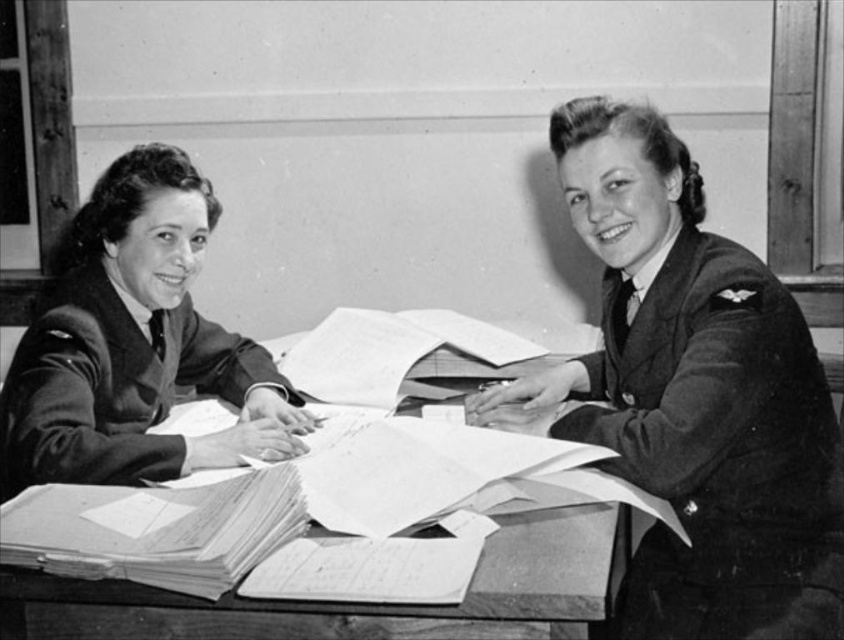
Between uniformed woman at center and smooth fabric uniform at left, which one appears on the left side from the viewer's perspective?

smooth fabric uniform at left is more to the left.

Is the position of uniformed woman at center less distant than that of smooth fabric uniform at left?

That is True.

At what (x,y) coordinates should I click in order to perform the action: click on uniformed woman at center. Please return your answer as a coordinate pair (x, y). The image size is (844, 640). Looking at the image, I should click on (694, 396).

Who is positioned more to the right, smooth fabric uniform at left or wooden table at center?

wooden table at center

Where is `smooth fabric uniform at left`? The height and width of the screenshot is (640, 844). smooth fabric uniform at left is located at coordinates (134, 344).

Is uniformed woman at center below wooden table at center?

Incorrect, uniformed woman at center is not positioned below wooden table at center.

Is point (739, 397) farther from viewer compared to point (160, 625)?

Yes, it is behind point (160, 625).

Find the location of a particular element. uniformed woman at center is located at coordinates (694, 396).

I want to click on uniformed woman at center, so click(x=694, y=396).